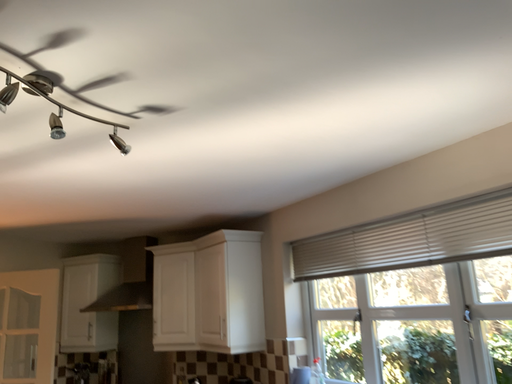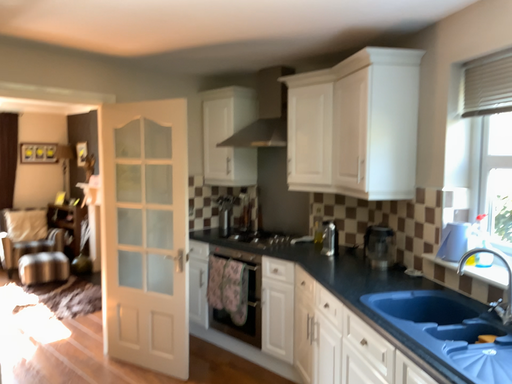
Question: How did the camera likely rotate when shooting the video?

Choices:
 (A) rotated left
 (B) rotated right

Answer: (A)